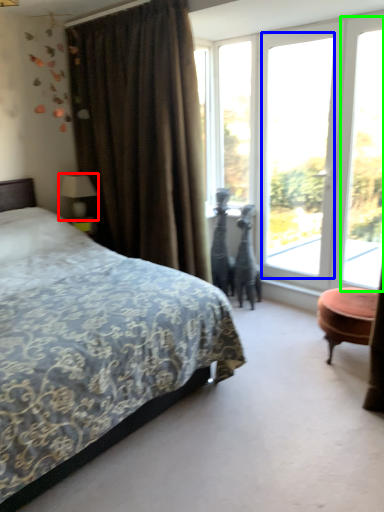
Question: Which is farther away from table lamp (highlighted by a red box)? window (highlighted by a blue box) or window screen (highlighted by a green box)?

Choices:
 (A) window
 (B) window screen

Answer: (B)